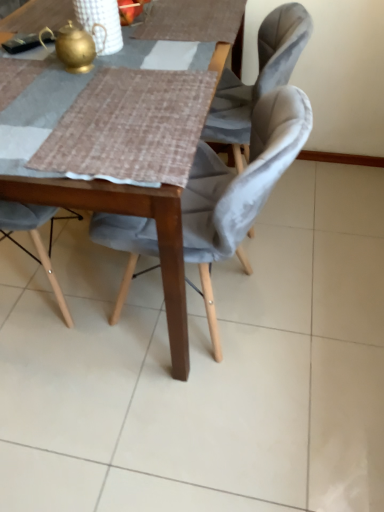
Question: Is velvet grey chair at center touching gold metallic teapot at upper left?

Choices:
 (A) no
 (B) yes

Answer: (A)

Question: Does velvet grey chair at center come behind gold metallic teapot at upper left?

Choices:
 (A) yes
 (B) no

Answer: (B)

Question: Is velvet grey chair at center to the left of gold metallic teapot at upper left from the viewer's perspective?

Choices:
 (A) no
 (B) yes

Answer: (A)

Question: Is gold metallic teapot at upper left surrounded by velvet grey chair at center?

Choices:
 (A) yes
 (B) no

Answer: (B)

Question: Is velvet grey chair at center oriented towards gold metallic teapot at upper left?

Choices:
 (A) yes
 (B) no

Answer: (B)

Question: From a real-world perspective, is velvet grey chair at center beneath gold metallic teapot at upper left?

Choices:
 (A) no
 (B) yes

Answer: (B)

Question: Is wooden table at center positioned with its back to gold metallic teapot at upper left?

Choices:
 (A) yes
 (B) no

Answer: (B)

Question: Is the depth of wooden table at center less than that of gold metallic teapot at upper left?

Choices:
 (A) yes
 (B) no

Answer: (A)

Question: Does wooden table at center appear on the left side of gold metallic teapot at upper left?

Choices:
 (A) yes
 (B) no

Answer: (B)

Question: Is wooden table at center completely or partially outside of gold metallic teapot at upper left?

Choices:
 (A) no
 (B) yes

Answer: (B)

Question: From a real-world perspective, is wooden table at center located higher than gold metallic teapot at upper left?

Choices:
 (A) yes
 (B) no

Answer: (B)

Question: Can you confirm if wooden table at center is bigger than gold metallic teapot at upper left?

Choices:
 (A) yes
 (B) no

Answer: (A)

Question: Does gold metallic teapot at upper left come in front of wooden table at center?

Choices:
 (A) no
 (B) yes

Answer: (A)